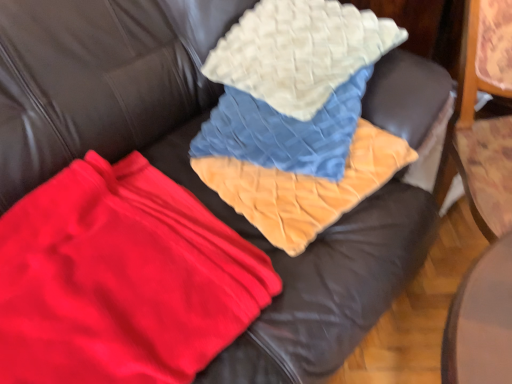
Question: Can you confirm if velvet orange blanket at center is taller than white quilted pillow at upper center?

Choices:
 (A) no
 (B) yes

Answer: (A)

Question: Is velvet orange blanket at center closer to the viewer compared to white quilted pillow at upper center?

Choices:
 (A) no
 (B) yes

Answer: (B)

Question: Does velvet orange blanket at center have a smaller size compared to white quilted pillow at upper center?

Choices:
 (A) yes
 (B) no

Answer: (A)

Question: From the image's perspective, is velvet orange blanket at center under white quilted pillow at upper center?

Choices:
 (A) yes
 (B) no

Answer: (A)

Question: Is velvet orange blanket at center facing towards white quilted pillow at upper center?

Choices:
 (A) no
 (B) yes

Answer: (A)

Question: From a real-world perspective, is velvet orange blanket at center physically above white quilted pillow at upper center?

Choices:
 (A) no
 (B) yes

Answer: (A)

Question: From a real-world perspective, does red fleece blanket at center stand above velvet orange blanket at center?

Choices:
 (A) no
 (B) yes

Answer: (A)

Question: From the image's perspective, is red fleece blanket at center located above velvet orange blanket at center?

Choices:
 (A) yes
 (B) no

Answer: (B)

Question: From the image's perspective, is red fleece blanket at center below velvet orange blanket at center?

Choices:
 (A) yes
 (B) no

Answer: (A)

Question: Is red fleece blanket at center positioned behind velvet orange blanket at center?

Choices:
 (A) no
 (B) yes

Answer: (A)

Question: Is red fleece blanket at center wider than velvet orange blanket at center?

Choices:
 (A) yes
 (B) no

Answer: (A)

Question: Is red fleece blanket at center positioned in front of velvet orange blanket at center?

Choices:
 (A) no
 (B) yes

Answer: (B)

Question: Is red fleece blanket at center smaller than white quilted pillow at upper center?

Choices:
 (A) no
 (B) yes

Answer: (B)